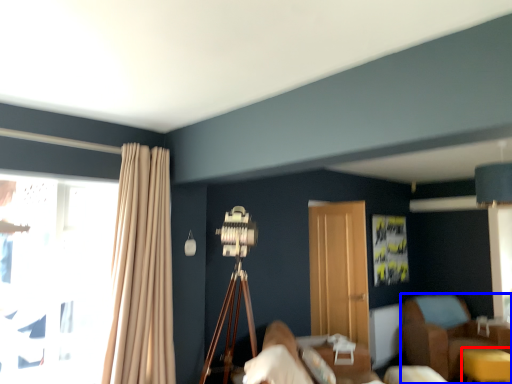
Question: Which object appears closest to the camera in this image, table (highlighted by a red box) or furniture (highlighted by a blue box)?

Choices:
 (A) table
 (B) furniture

Answer: (A)